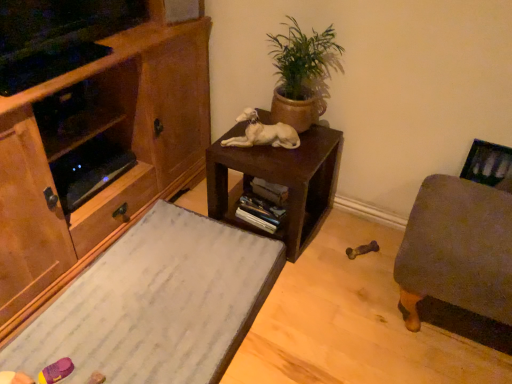
Locate an element on the screen. This screenshot has width=512, height=384. vacant area located to the right-hand side of white glossy statue at center is located at coordinates (310, 144).